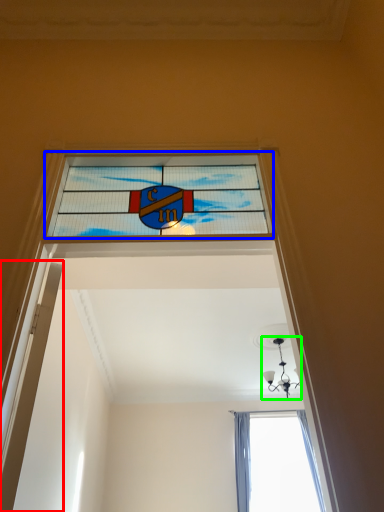
Question: Considering the real-world distances, which object is farthest from door (highlighted by a red box)? window (highlighted by a blue box) or light fixture (highlighted by a green box)?

Choices:
 (A) window
 (B) light fixture

Answer: (B)